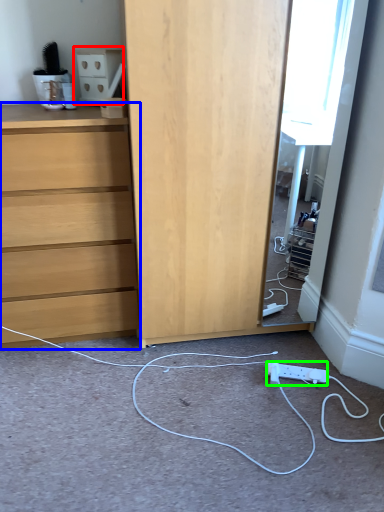
Question: Based on their relative distances, which object is farther from cabinetry (highlighted by a red box)? Choose from chest of drawers (highlighted by a blue box) and electric outlet (highlighted by a green box).

Choices:
 (A) chest of drawers
 (B) electric outlet

Answer: (B)